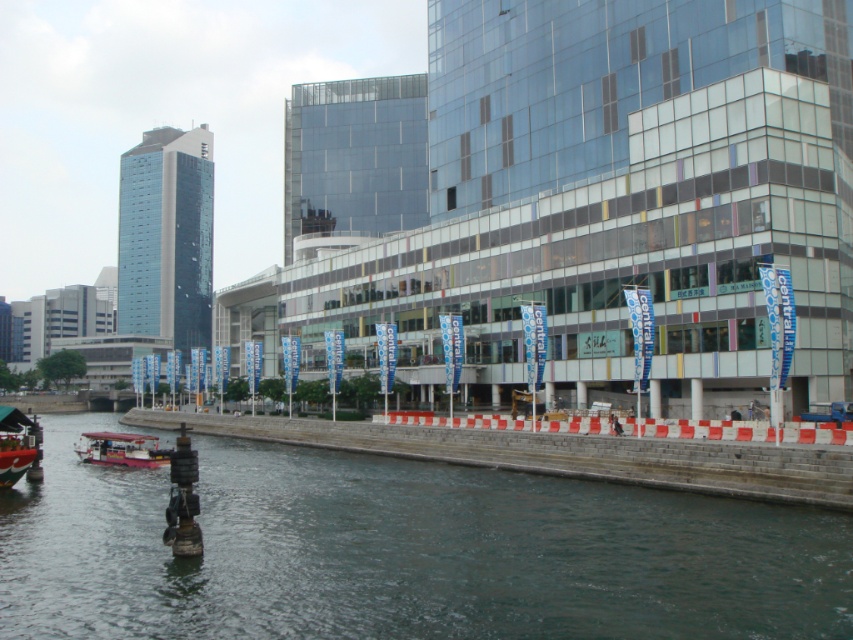
Question: Is the position of dark gray water at lower left more distant than that of red plastic boat at lower left?

Choices:
 (A) no
 (B) yes

Answer: (A)

Question: Which object is positioned closest to the dark gray water at lower left?

Choices:
 (A) red plastic boat at lower left
 (B) pink plastic boat at lower left

Answer: (A)

Question: Which of the following is the farthest from the observer?

Choices:
 (A) (129, 461)
 (B) (4, 416)

Answer: (A)

Question: Is dark gray water at lower left further to camera compared to pink plastic boat at lower left?

Choices:
 (A) yes
 (B) no

Answer: (B)

Question: Which point is farther to the camera?

Choices:
 (A) (368, 593)
 (B) (13, 452)

Answer: (B)

Question: Is dark gray water at lower left above red plastic boat at lower left?

Choices:
 (A) yes
 (B) no

Answer: (B)